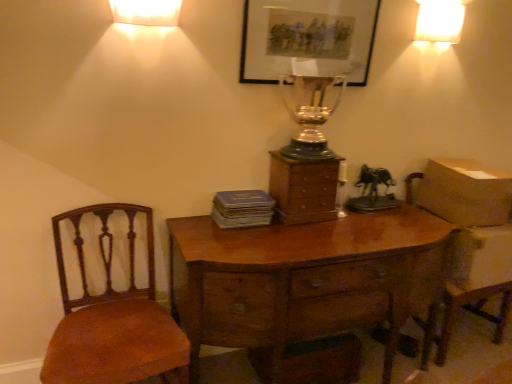
This screenshot has height=384, width=512. Find the location of `vacant region to the right of wooden chest of drawers at center`. vacant region to the right of wooden chest of drawers at center is located at coordinates (359, 227).